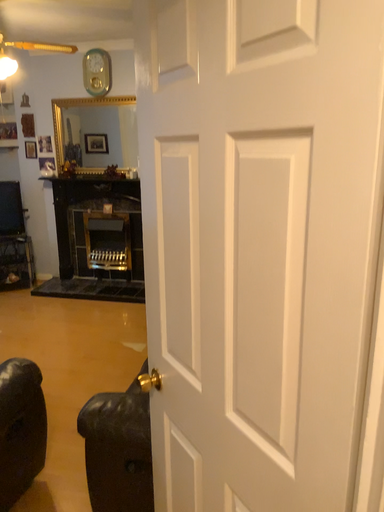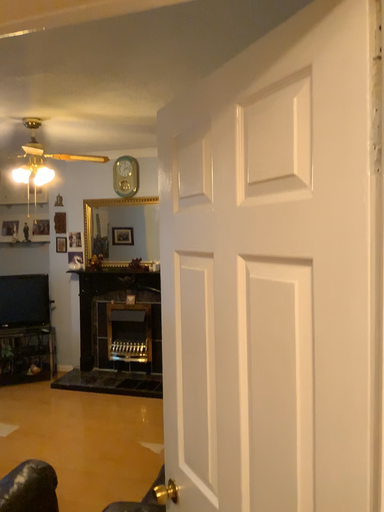
Question: How did the camera likely rotate when shooting the video?

Choices:
 (A) rotated downward
 (B) rotated upward

Answer: (B)